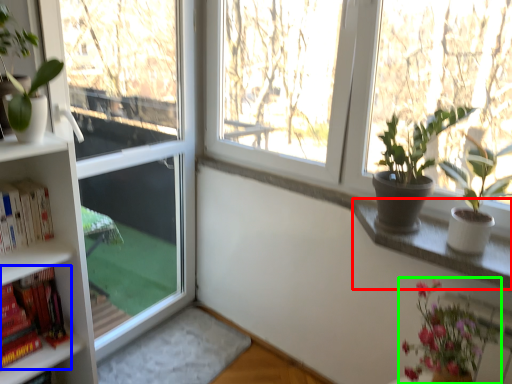
Question: Estimate the real-world distances between objects in this image. Which object is closer to window sill (highlighted by a red box), book (highlighted by a blue box) or houseplant (highlighted by a green box)?

Choices:
 (A) book
 (B) houseplant

Answer: (B)